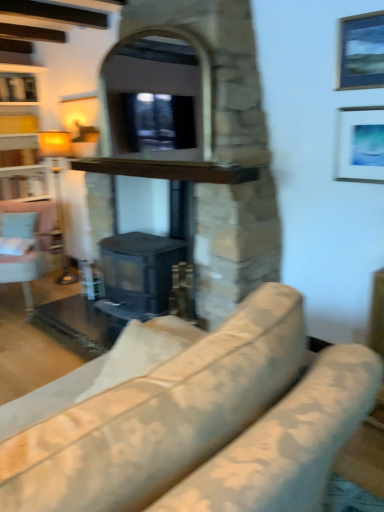
Where is `metallic silver picture frame at upper right, the 2th picture frame positioned from the bottom`? This screenshot has width=384, height=512. metallic silver picture frame at upper right, the 2th picture frame positioned from the bottom is located at coordinates (361, 51).

At what (x,y) coordinates should I click in order to perform the action: click on matte white picture frame at upper right, acting as the second picture frame starting from the top. Please return your answer as a coordinate pair (x, y). This screenshot has height=512, width=384. Looking at the image, I should click on (359, 144).

What do you see at coordinates (203, 425) in the screenshot?
I see `floral fabric couch at center` at bounding box center [203, 425].

What is the approximate width of matte yellow lampshade at left?

The width of matte yellow lampshade at left is 12.59 inches.

The height and width of the screenshot is (512, 384). What are the coordinates of `light blue fabric swivel chair at left` in the screenshot? It's located at (x=19, y=252).

The image size is (384, 512). Describe the element at coordinates (19, 252) in the screenshot. I see `light blue fabric swivel chair at left` at that location.

Locate an element on the screen. metallic silver picture frame at upper right, the 2th picture frame positioned from the bottom is located at coordinates (361, 51).

Relative to matte black fireplace at center, the first fireplace in the top-to-bottom sequence, is brown wooden shelf at center in front or behind?

brown wooden shelf at center is positioned farther from the viewer than matte black fireplace at center, the first fireplace in the top-to-bottom sequence.

From the image's perspective, which one is positioned higher, brown wooden shelf at center or matte black fireplace at center, which is counted as the second fireplace, starting from the bottom?

brown wooden shelf at center.

Is brown wooden shelf at center facing towards matte black fireplace at center, the first fireplace in the top-to-bottom sequence?

Yes.

Visually, is brown wooden shelf at center positioned to the left or to the right of matte black fireplace at center, which is counted as the second fireplace, starting from the bottom?

Clearly, brown wooden shelf at center is on the right of matte black fireplace at center, which is counted as the second fireplace, starting from the bottom, in the image.

Based on the photo, between floral fabric couch at center and matte black fireplace at center, the first fireplace in the top-to-bottom sequence, which one has larger size?

matte black fireplace at center, the first fireplace in the top-to-bottom sequence.

Choose the correct answer: Is floral fabric couch at center inside matte black fireplace at center, which is counted as the second fireplace, starting from the bottom, or outside it?

floral fabric couch at center exists outside the volume of matte black fireplace at center, which is counted as the second fireplace, starting from the bottom.

Based on the photo, is floral fabric couch at center far from matte black fireplace at center, which is counted as the second fireplace, starting from the bottom?

That's right, there is a large distance between floral fabric couch at center and matte black fireplace at center, which is counted as the second fireplace, starting from the bottom.

How many degrees apart are the facing directions of floral fabric couch at center and matte black fireplace at center, which is counted as the second fireplace, starting from the bottom?

The angle between the facing direction of floral fabric couch at center and the facing direction of matte black fireplace at center, which is counted as the second fireplace, starting from the bottom, is 88.6 degrees.

Is matte black fireplace at center, which is counted as the second fireplace, starting from the bottom, aimed at light blue fabric swivel chair at left?

No, matte black fireplace at center, which is counted as the second fireplace, starting from the bottom, does not turn towards light blue fabric swivel chair at left.

Looking at this image, would you say light blue fabric swivel chair at left is part of matte black fireplace at center, which is counted as the second fireplace, starting from the bottom,'s contents?

No, matte black fireplace at center, which is counted as the second fireplace, starting from the bottom, does not contain light blue fabric swivel chair at left.

Does matte black fireplace at center, the first fireplace in the top-to-bottom sequence, have a greater width compared to light blue fabric swivel chair at left?

Yes.

Is light blue fabric swivel chair at left wider than floral fabric couch at center?

In fact, light blue fabric swivel chair at left might be narrower than floral fabric couch at center.

In terms of size, does light blue fabric swivel chair at left appear bigger or smaller than floral fabric couch at center?

Considering their sizes, light blue fabric swivel chair at left takes up less space than floral fabric couch at center.

Is floral fabric couch at center a part of light blue fabric swivel chair at left?

That's incorrect, floral fabric couch at center is not inside light blue fabric swivel chair at left.

Considering the positions of objects light blue fabric swivel chair at left and floral fabric couch at center in the image provided, who is behind, light blue fabric swivel chair at left or floral fabric couch at center?

light blue fabric swivel chair at left is more distant.

Are brown wooden shelf at center and metallic silver picture frame at upper right, the first picture frame viewed from the top, making contact?

No, brown wooden shelf at center is not touching metallic silver picture frame at upper right, the first picture frame viewed from the top.

Find the location of a particular element. The height and width of the screenshot is (512, 384). mantle that appears below the metallic silver picture frame at upper right, the 2th picture frame positioned from the bottom (from the image's perspective) is located at coordinates (169, 170).

Which of these two, brown wooden shelf at center or metallic silver picture frame at upper right, the first picture frame viewed from the top, is bigger?

Bigger between the two is brown wooden shelf at center.

From the image's perspective, is matte yellow lampshade at left positioned above or below light blue fabric swivel chair at left?

matte yellow lampshade at left is situated higher than light blue fabric swivel chair at left in the image.

Does matte yellow lampshade at left have a greater width compared to light blue fabric swivel chair at left?

No, matte yellow lampshade at left is not wider than light blue fabric swivel chair at left.

Is light blue fabric swivel chair at left completely or partially inside matte yellow lampshade at left?

No, light blue fabric swivel chair at left is not surrounded by matte yellow lampshade at left.

Is light blue fabric swivel chair at left aimed at matte white picture frame at upper right, arranged as the first picture frame when ordered from the bottom?

No, light blue fabric swivel chair at left is not facing towards matte white picture frame at upper right, arranged as the first picture frame when ordered from the bottom.

Would you say light blue fabric swivel chair at left contains matte white picture frame at upper right, arranged as the first picture frame when ordered from the bottom?

No, matte white picture frame at upper right, arranged as the first picture frame when ordered from the bottom, is not surrounded by light blue fabric swivel chair at left.

From a real-world perspective, is light blue fabric swivel chair at left beneath matte white picture frame at upper right, arranged as the first picture frame when ordered from the bottom?

Yes.

The width and height of the screenshot is (384, 512). Find the location of `the 2nd fireplace counting from the left side of the brown wooden shelf at center`. the 2nd fireplace counting from the left side of the brown wooden shelf at center is located at coordinates (224, 147).

From a real-world perspective, which fireplace is the 2nd one above the floral fabric couch at center? Please provide its 2D coordinates.

[(224, 147)]

Based on their spatial positions, is floral fabric couch at center or brown wooden shelf at center further from metallic silver picture frame at upper right, the 2th picture frame positioned from the bottom?

Based on the image, floral fabric couch at center appears to be further to metallic silver picture frame at upper right, the 2th picture frame positioned from the bottom.

Considering their positions, is light blue fabric swivel chair at left positioned closer to metallic silver picture frame at upper right, the 2th picture frame positioned from the bottom, than floral fabric couch at center?

floral fabric couch at center.

Estimate the real-world distances between objects in this image. Which object is further from floral fabric couch at center, matte white picture frame at upper right, arranged as the first picture frame when ordered from the bottom, or brown wooden shelf at center?

matte white picture frame at upper right, arranged as the first picture frame when ordered from the bottom.

Looking at the image, which one is located further to floral fabric couch at center, light blue fabric swivel chair at left or matte yellow lampshade at left?

→ The object further to floral fabric couch at center is matte yellow lampshade at left.

Which object lies further to the anchor point light blue fabric swivel chair at left, matte white picture frame at upper right, acting as the second picture frame starting from the top, or matte yellow lampshade at left?

Based on the image, matte white picture frame at upper right, acting as the second picture frame starting from the top, appears to be further to light blue fabric swivel chair at left.

Based on their spatial positions, is metallic silver picture frame at upper right, the first picture frame viewed from the top, or matte black fireplace at center, which is counted as the second fireplace, starting from the bottom, further from black matte fireplace at center, which is the second fireplace from top to bottom?

metallic silver picture frame at upper right, the first picture frame viewed from the top, is positioned further to the anchor black matte fireplace at center, which is the second fireplace from top to bottom.

Considering their positions, is light blue fabric swivel chair at left positioned closer to matte yellow lampshade at left than matte white picture frame at upper right, arranged as the first picture frame when ordered from the bottom?

The object closer to matte yellow lampshade at left is light blue fabric swivel chair at left.

Estimate the real-world distances between objects in this image. Which object is closer to brown wooden shelf at center, floral fabric couch at center or light blue fabric swivel chair at left?

light blue fabric swivel chair at left is closer to brown wooden shelf at center.

Locate an element on the screen. mantle between matte black fireplace at center, the first fireplace in the top-to-bottom sequence, and matte yellow lampshade at left in the front-back direction is located at coordinates (169, 170).

You are a GUI agent. You are given a task and a screenshot of the screen. Output one action in this format:
    pyautogui.click(x=<x>, y=<y>)
    Task: Click on the mantle situated between matte yellow lampshade at left and metallic silver picture frame at upper right, the 2th picture frame positioned from the bottom, from left to right
    This screenshot has width=384, height=512.
    Given the screenshot: What is the action you would take?
    pyautogui.click(x=169, y=170)

Where is `fireplace between matte black fireplace at center, the first fireplace in the top-to-bottom sequence, and matte white picture frame at upper right, arranged as the first picture frame when ordered from the bottom, from left to right`? fireplace between matte black fireplace at center, the first fireplace in the top-to-bottom sequence, and matte white picture frame at upper right, arranged as the first picture frame when ordered from the bottom, from left to right is located at coordinates (172, 177).

This screenshot has width=384, height=512. What are the coordinates of `swivel chair between floral fabric couch at center and matte yellow lampshade at left from front to back` in the screenshot? It's located at (19, 252).